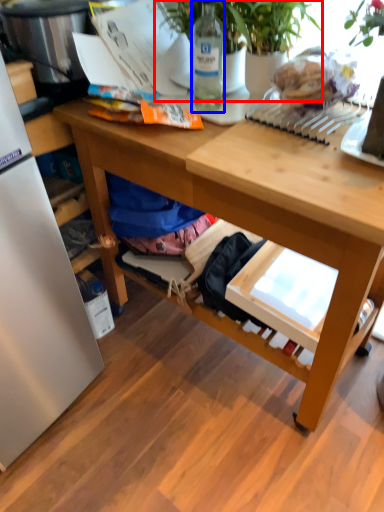
Question: Which point is further to the camera, houseplant (highlighted by a red box) or bottle (highlighted by a blue box)?

Choices:
 (A) houseplant
 (B) bottle

Answer: (B)